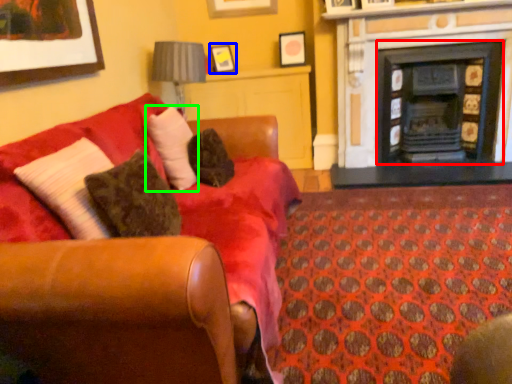
Question: Which is nearer to the fireplace (highlighted by a red box)? picture frame (highlighted by a blue box) or pillow (highlighted by a green box).

Choices:
 (A) picture frame
 (B) pillow

Answer: (A)